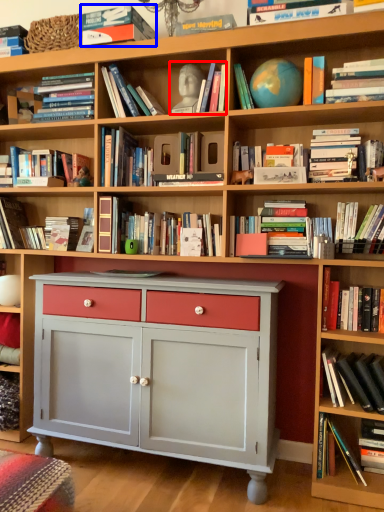
Question: Which point is closer to the camera, book (highlighted by a red box) or book (highlighted by a blue box)?

Choices:
 (A) book
 (B) book

Answer: (B)